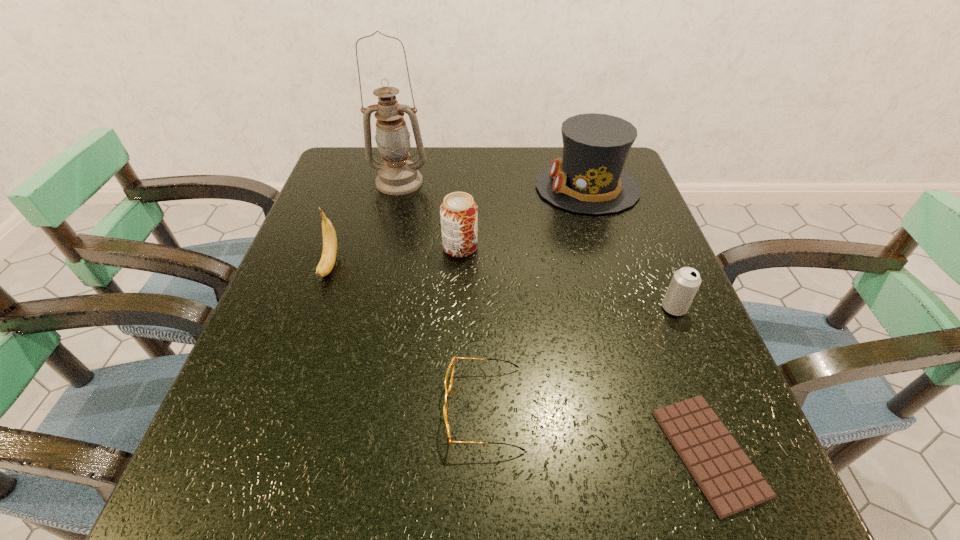
Image resolution: width=960 pixels, height=540 pixels. In order to click on the sixth object from right to left in this screenshot , I will do `click(397, 176)`.

This screenshot has width=960, height=540. In order to click on oil lamp in this screenshot , I will do `click(397, 176)`.

Identify the location of dress hat. (589, 179).

At what (x,y) coordinates should I click in order to perform the action: click on the left beer can. Please return your answer as a coordinate pair (x, y). The height and width of the screenshot is (540, 960). Looking at the image, I should click on (458, 212).

Find the location of `the taller beer can`. the taller beer can is located at coordinates (458, 212).

Locate an element on the screen. banana is located at coordinates (328, 258).

The height and width of the screenshot is (540, 960). I want to click on the right beer can, so click(685, 282).

The image size is (960, 540). Find the location of `the nearer beer can`. the nearer beer can is located at coordinates (685, 282).

The width and height of the screenshot is (960, 540). I want to click on spectacles, so click(x=450, y=371).

The image size is (960, 540). Find the location of `the shortest object`. the shortest object is located at coordinates (731, 483).